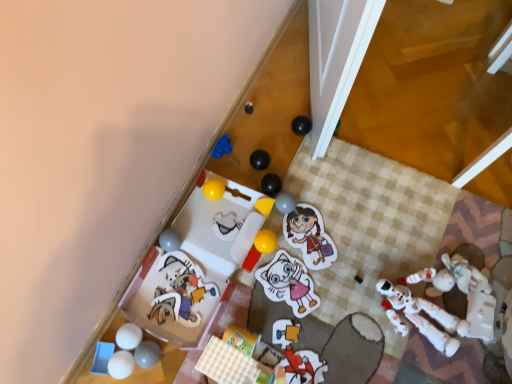
At what (x,y) coordinates should I click in order to perform the action: click on free space that is in between cartoon cat plush at lower left, positioned as the 5th toy in left-to-right order, and white matte cat at center, which is counted as the 2th toy, starting from the right. Please return your answer as a coordinate pair (x, y). The image size is (512, 384). Looking at the image, I should click on (234, 294).